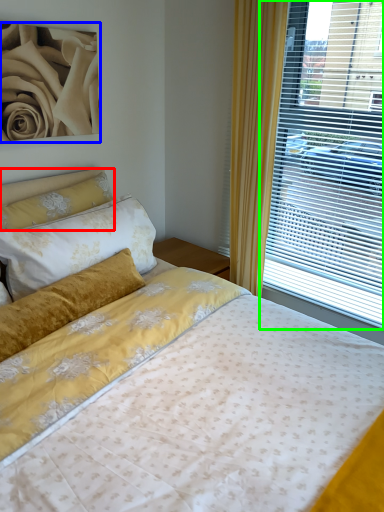
Question: Estimate the real-world distances between objects in this image. Which object is farther from pillow (highlighted by a red box), rose (highlighted by a blue box) or window (highlighted by a green box)?

Choices:
 (A) rose
 (B) window

Answer: (B)